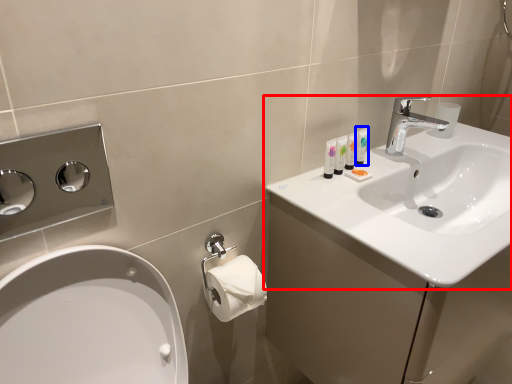
Question: Which object is closer to the camera taking this photo, sink (highlighted by a red box) or mouthwash (highlighted by a blue box)?

Choices:
 (A) sink
 (B) mouthwash

Answer: (A)